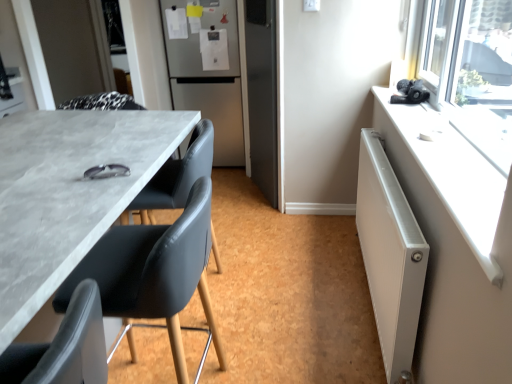
Locate an element on the screen. This screenshot has width=512, height=384. free space to the right of matte black chair at center, which appears as the 1th chair when viewed from the back is located at coordinates (260, 294).